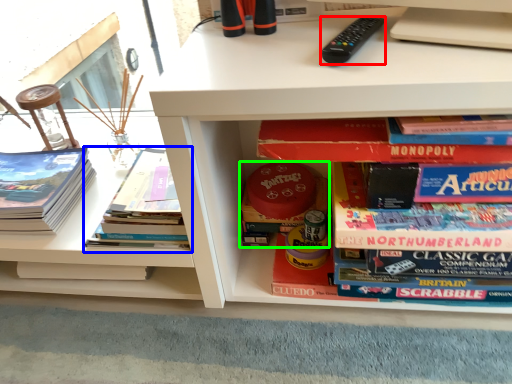
Question: Which object is positioned farthest from remote control (highlighted by a red box)? Select from book (highlighted by a blue box) and book (highlighted by a green box).

Choices:
 (A) book
 (B) book

Answer: (A)